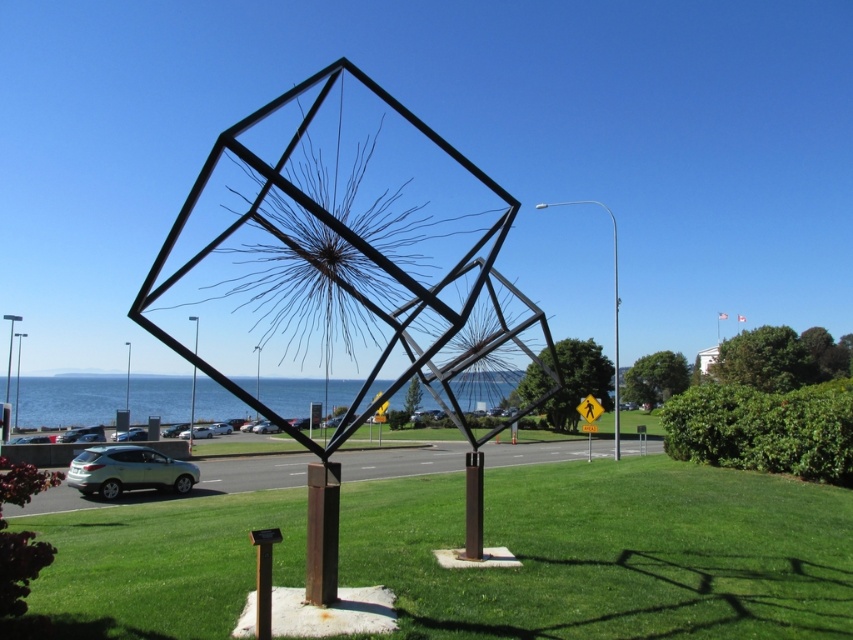
You are standing at the center of the sculpture and looking towards the road. There are two points marked on the ground in front of you. The first point is at coordinates point (772,499) and the second point is at point (93,460). Which point is closer to you?

Point (772,499) is in front of point (93,460), so the first point is closer to you.

You are standing 5 meters away from the sculpture. If you want to reach the point at coordinates point [798,602], which is part of the sculpture, how much further do you need to walk?

The point [798,602] is 6.08 meters away from the viewer. Since you are already 5 meters away from the sculpture, you need to walk an additional 1.08 meters to reach the point.